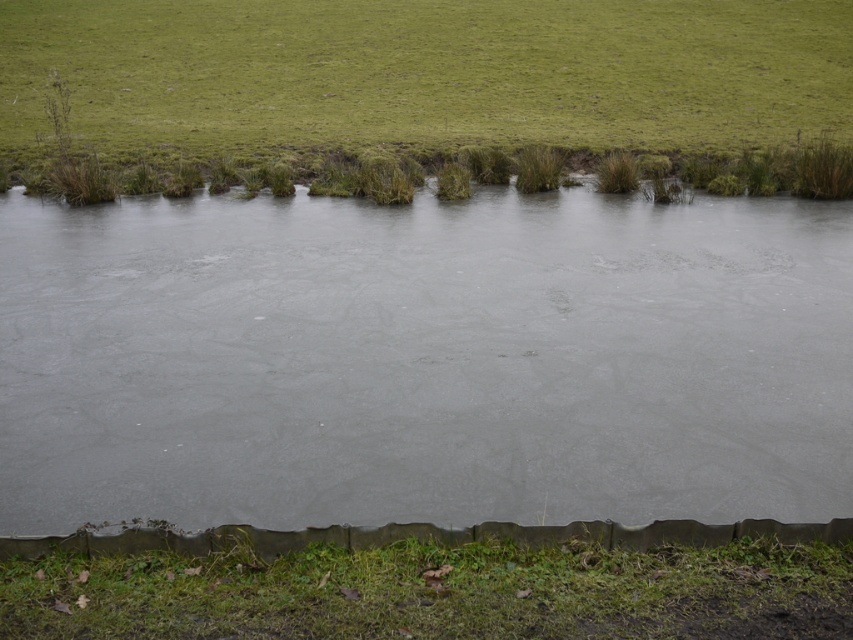
Question: Which of these objects is positioned farthest from the green grassy at upper center?

Choices:
 (A) gray matte water at center
 (B) green grassy at lower center

Answer: (B)

Question: Does gray matte water at center have a lesser width compared to green grassy at upper center?

Choices:
 (A) yes
 (B) no

Answer: (A)

Question: Can you confirm if green grassy at upper center is positioned to the right of green grassy at lower center?

Choices:
 (A) no
 (B) yes

Answer: (A)

Question: Which object is positioned closest to the green grassy at upper center?

Choices:
 (A) gray matte water at center
 (B) green grassy at lower center

Answer: (A)

Question: Estimate the real-world distances between objects in this image. Which object is closer to the gray matte water at center?

Choices:
 (A) green grassy at lower center
 (B) green grassy at upper center

Answer: (A)

Question: Is gray matte water at center below green grassy at upper center?

Choices:
 (A) no
 (B) yes

Answer: (B)